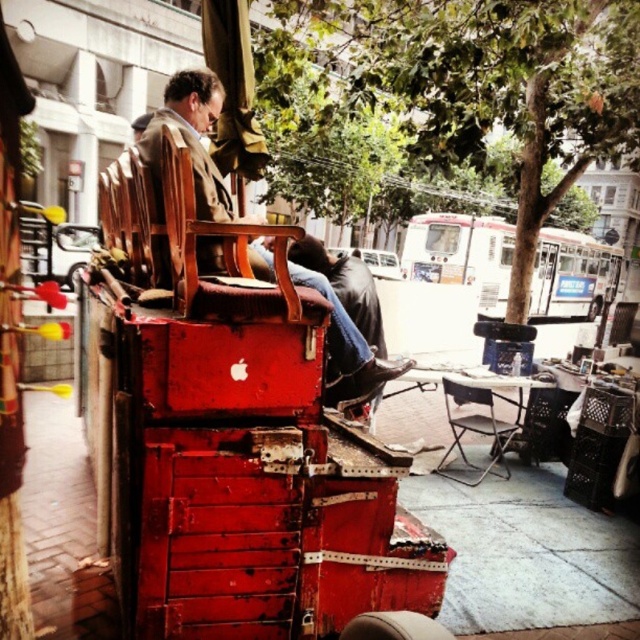
Question: Does wooden chair at center come in front of metallic silver folding chair at center?

Choices:
 (A) no
 (B) yes

Answer: (B)

Question: Is wooden chair at center further to camera compared to metallic silver folding chair at center?

Choices:
 (A) no
 (B) yes

Answer: (A)

Question: Which point appears closest to the camera in this image?

Choices:
 (A) (355, 384)
 (B) (488, 428)

Answer: (A)

Question: Does wooden chair at center have a larger size compared to metallic silver folding chair at center?

Choices:
 (A) yes
 (B) no

Answer: (A)

Question: Among these points, which one is nearest to the camera?

Choices:
 (A) (326, 291)
 (B) (516, 422)

Answer: (A)